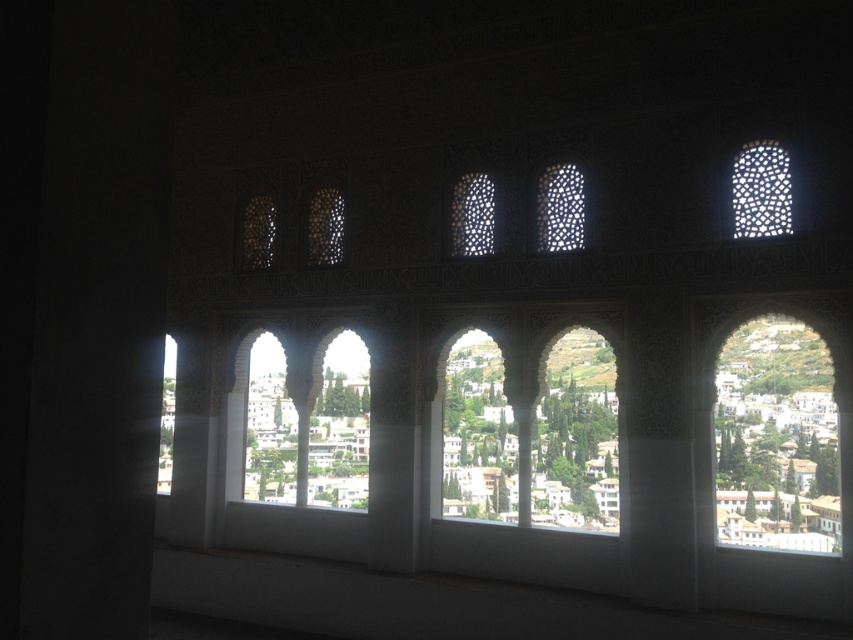
You are standing in the room and want to touch the white lattice at upper right and the translucent glass lattice at center. Which lattice should you reach for first to touch the one closer to you?

The white lattice at upper right is closer to the viewer, so you should reach for it first to touch the one closer to you.

You are an architect designing a new building and want to ensure that the white lattice at upper right and the translucent glass lattice at center are proportionate in height. According to the scene, which lattice has a greater height?

The white lattice at upper right has a greater height compared to the translucent glass lattice at center.

Consider the image. You are standing in the room and want to know how far the point at coordinates (451, 248) is from your current position. Can you determine the distance?

The point at coordinates (451, 248) is 56.36 meters from the camera, so the distance from your current position is 56.36 meters.